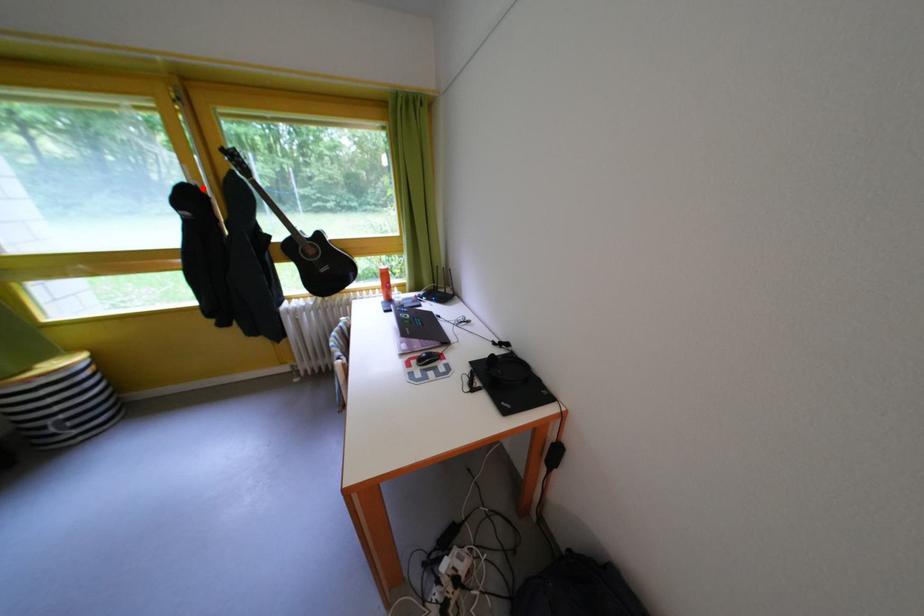
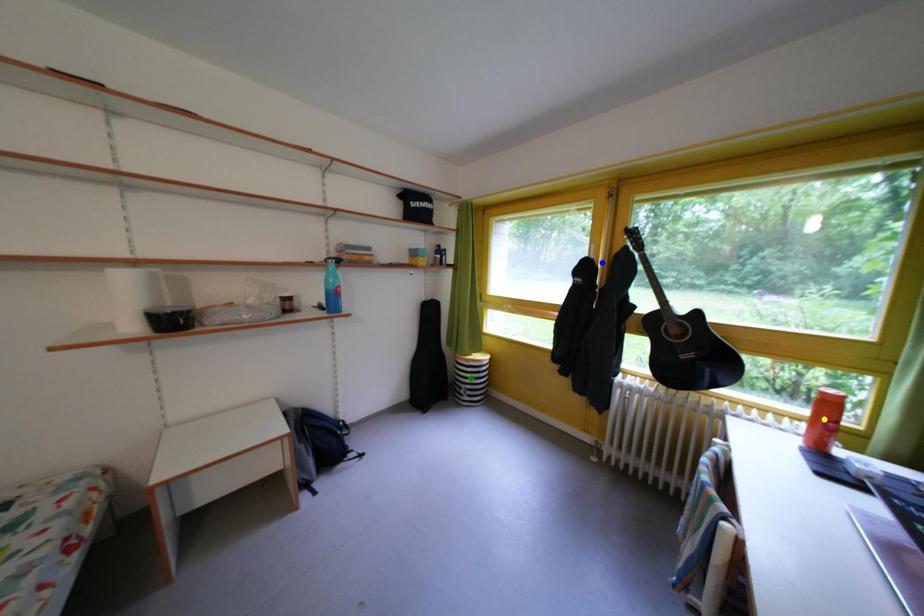
Question: I am providing you with two images of the same scene from different viewpoints. A red point is marked on the first image. You are given multiple points on the second image. In image 2, which mark is for the same physical point as the one in image 1?

Choices:
 (A) blue point
 (B) yellow point
 (C) green point

Answer: (A)